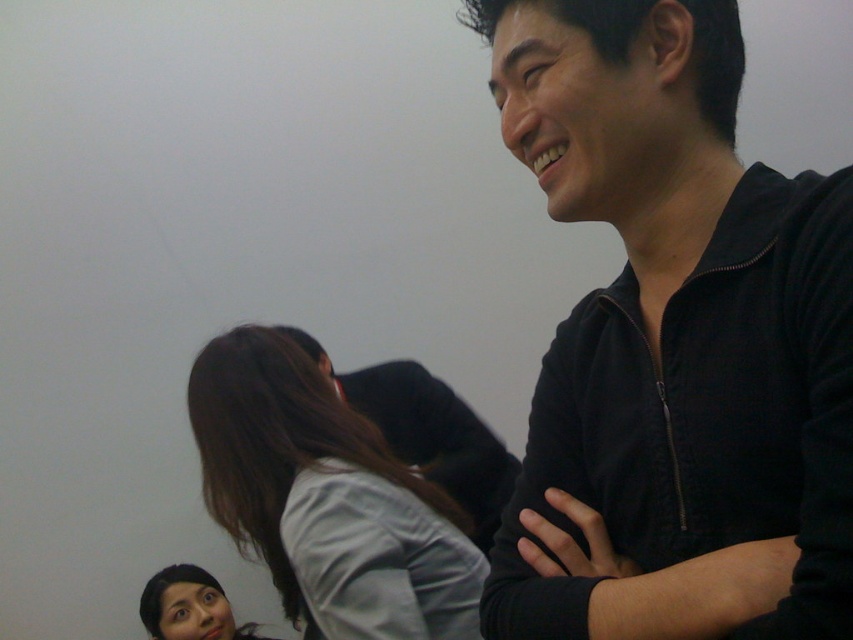
Question: Is gray fabric shirt at center smaller than smooth skin face at lower left?

Choices:
 (A) yes
 (B) no

Answer: (B)

Question: Is black zip-up jacket at upper right wider than gray fabric shirt at center?

Choices:
 (A) no
 (B) yes

Answer: (A)

Question: Based on their relative distances, which object is nearer to the black zip-up jacket at upper right?

Choices:
 (A) smooth skin face at lower left
 (B) gray fabric shirt at center
 (C) black matte jacket at upper right

Answer: (B)

Question: Which object is farther from the camera taking this photo?

Choices:
 (A) black matte jacket at upper right
 (B) gray fabric shirt at center
 (C) black zip-up jacket at upper right

Answer: (A)

Question: Which point is closer to the camera?

Choices:
 (A) (206, 625)
 (B) (405, 388)

Answer: (B)

Question: Does black matte jacket at upper right appear on the right side of smooth skin face at lower left?

Choices:
 (A) no
 (B) yes

Answer: (B)